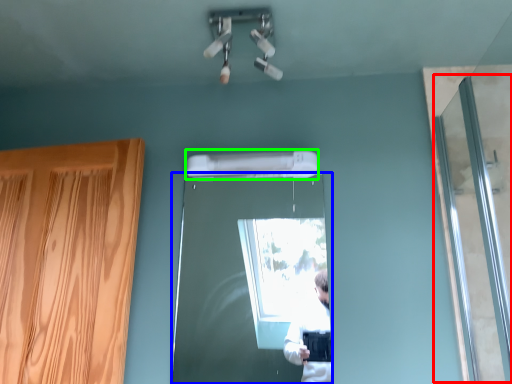
Question: Which is nearer to the screen door (highlighted by a red box)? door (highlighted by a blue box) or air conditioner (highlighted by a green box).

Choices:
 (A) door
 (B) air conditioner

Answer: (B)